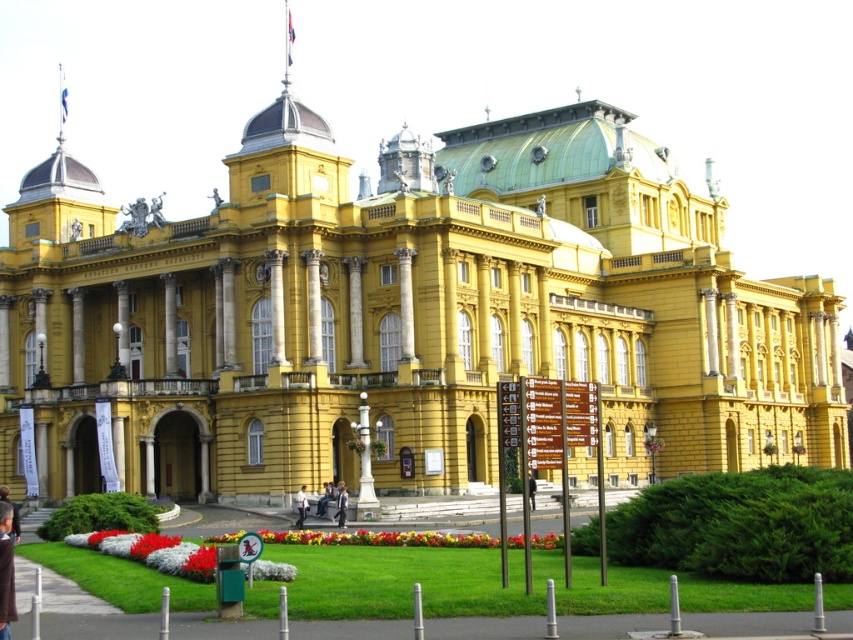
You are standing on the lawn in front of the building and see both the brown leather jacket at lower left and the light blue fabric jacket at center. Which jacket is taller?

The brown leather jacket at lower left is taller than the light blue fabric jacket at center.

You are a photographer planning to take a photo of the grand building. You notice a person wearing a light blue fabric jacket at center and light blue jeans at center in the foreground. To ensure both items of clothing are clearly visible in the photo, which one should you focus on first?

The light blue fabric jacket at center is larger in size than the light blue jeans at center, so focusing on the jacket first would ensure both are visible as it is the larger object.